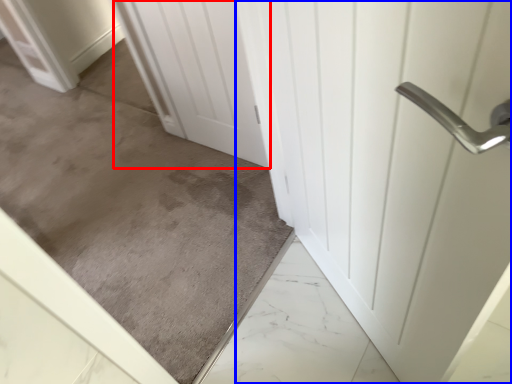
Question: Among these objects, which one is nearest to the camera, door (highlighted by a red box) or door (highlighted by a blue box)?

Choices:
 (A) door
 (B) door

Answer: (B)